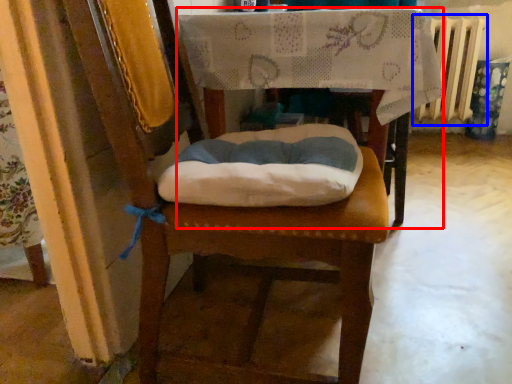
Question: Which object appears closest to the camera in this image, table (highlighted by a red box) or radiator (highlighted by a blue box)?

Choices:
 (A) table
 (B) radiator

Answer: (A)